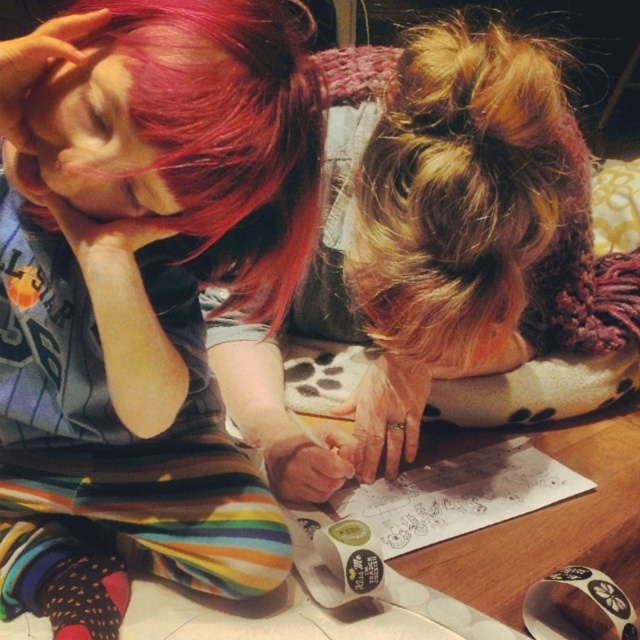
Question: Which point is farther to the camera?

Choices:
 (A) matte black shirt at center
 (B) blonde hair bun at upper center

Answer: (B)

Question: Is matte black shirt at center positioned in front of blonde hair bun at upper center?

Choices:
 (A) no
 (B) yes

Answer: (B)

Question: Is matte black shirt at center below blonde hair bun at upper center?

Choices:
 (A) no
 (B) yes

Answer: (B)

Question: Is the position of matte black shirt at center less distant than that of blonde hair bun at upper center?

Choices:
 (A) no
 (B) yes

Answer: (B)

Question: Which point is farther from the camera taking this photo?

Choices:
 (A) (410, 433)
 (B) (4, 321)

Answer: (A)